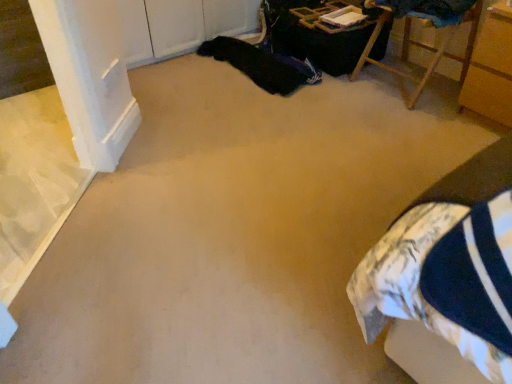
Question: Is wooden chair at upper right, which is the first furniture in left-to-right order, taller or shorter than wooden cabinet at right, the 1th furniture in the right-to-left sequence?

Choices:
 (A) short
 (B) tall

Answer: (A)

Question: Is point (x=449, y=26) positioned closer to the camera than point (x=499, y=96)?

Choices:
 (A) farther
 (B) closer

Answer: (A)

Question: Estimate the real-world distances between objects in this image. Which object is farther from the black fabric at upper center?

Choices:
 (A) wooden chair at upper right, the second furniture in the right-to-left sequence
 (B) wooden cabinet at right, the 1th furniture in the right-to-left sequence

Answer: (B)

Question: Considering the real-world distances, which object is farthest from the black fabric at upper center?

Choices:
 (A) wooden cabinet at right, which is counted as the 2th furniture, starting from the left
 (B) wooden chair at upper right, the second furniture in the right-to-left sequence

Answer: (A)